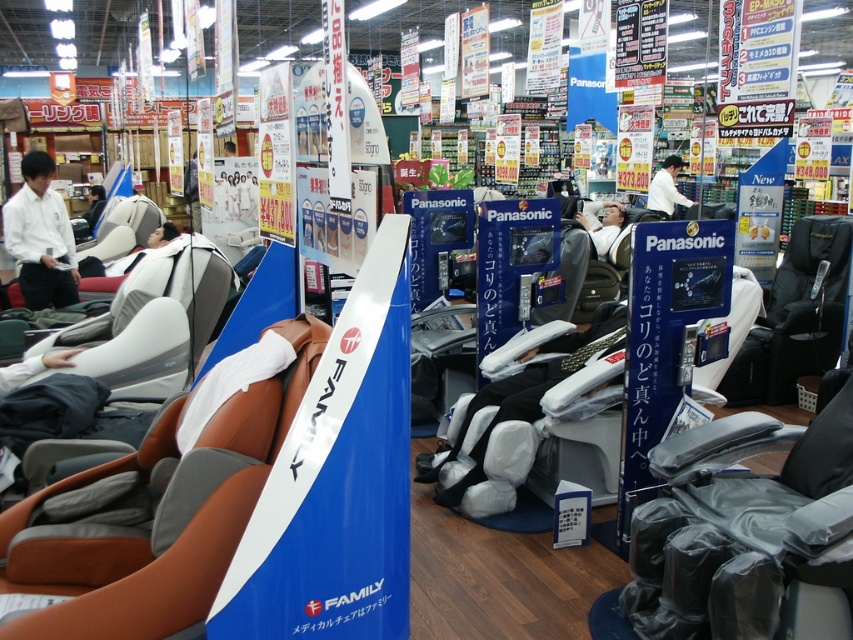
Consider the image. You are a customer in the store looking at the black leather massage chair at center and the white shirt at upper center. Which object is located to the left of the other?

The black leather massage chair at center is positioned to the left of the white shirt at upper center.

You are a customer standing at the entrance of the massage chair section. You want to see the display behind the black leather swivel chair at center and the matte black chair at center. Which chair should you move to get a better view?

You should move the black leather swivel chair at center because it is in front of the matte black chair at center, so moving it would reveal the display behind.